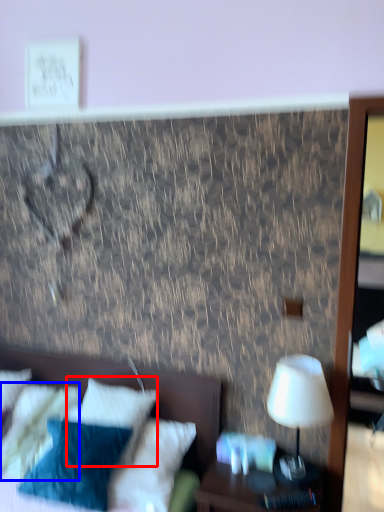
Question: Which object appears farthest to the camera in this image, pillow (highlighted by a red box) or pillow (highlighted by a blue box)?

Choices:
 (A) pillow
 (B) pillow

Answer: (B)